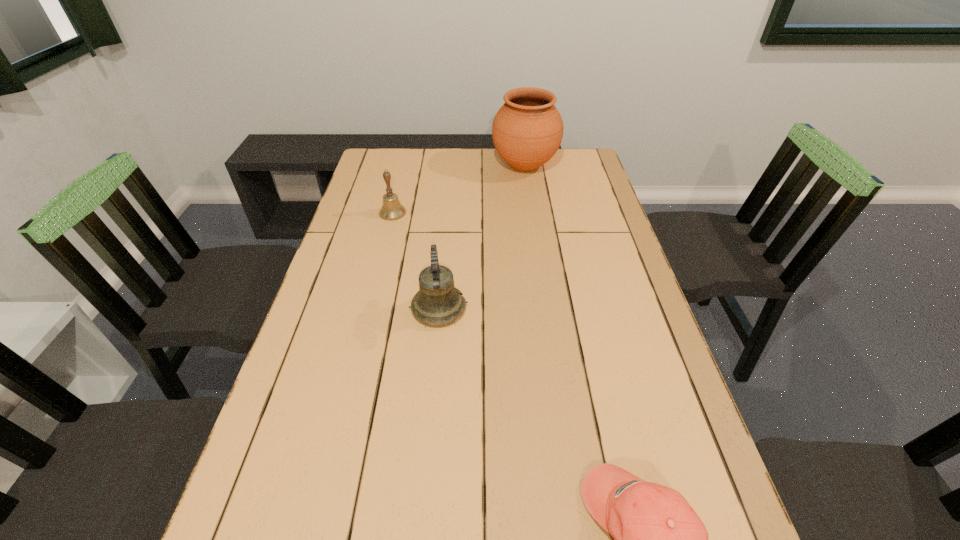
Identify the location of free area in between the third nearest object and the right bell. Image resolution: width=960 pixels, height=540 pixels. (416, 261).

At what (x,y) coordinates should I click in order to perform the action: click on the third closest object relative to the farther bell. Please return your answer as a coordinate pair (x, y). The height and width of the screenshot is (540, 960). Looking at the image, I should click on (659, 539).

Identify which object is located as the second nearest to the tallest object. Please provide its 2D coordinates. Your answer should be formatted as a tuple, i.e. [(x, y)], where the tuple contains the x and y coordinates of a point satisfying the conditions above.

[(438, 302)]

Where is `vacant space that satisfies the following two spatial constraints: 1. on the front side of the right bell; 2. on the left side of the second farthest object`? This screenshot has height=540, width=960. vacant space that satisfies the following two spatial constraints: 1. on the front side of the right bell; 2. on the left side of the second farthest object is located at coordinates (369, 308).

You are a GUI agent. You are given a task and a screenshot of the screen. Output one action in this format:
    pyautogui.click(x=<x>, y=<y>)
    Task: Click on the free space that satisfies the following two spatial constraints: 1. on the back side of the pottery; 2. on the right side of the second nearest object
    This screenshot has width=960, height=540.
    Given the screenshot: What is the action you would take?
    pyautogui.click(x=452, y=165)